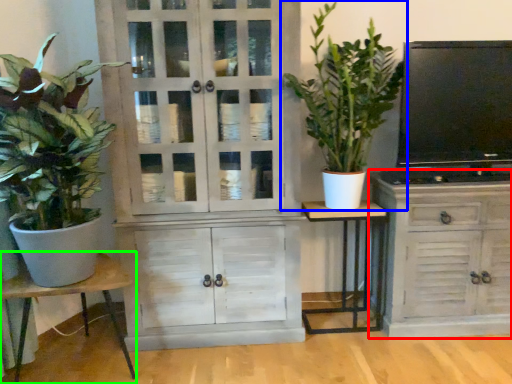
Question: Which object is positioned farthest from cabinetry (highlighted by a red box)? Select from houseplant (highlighted by a blue box) and table (highlighted by a green box).

Choices:
 (A) houseplant
 (B) table

Answer: (B)